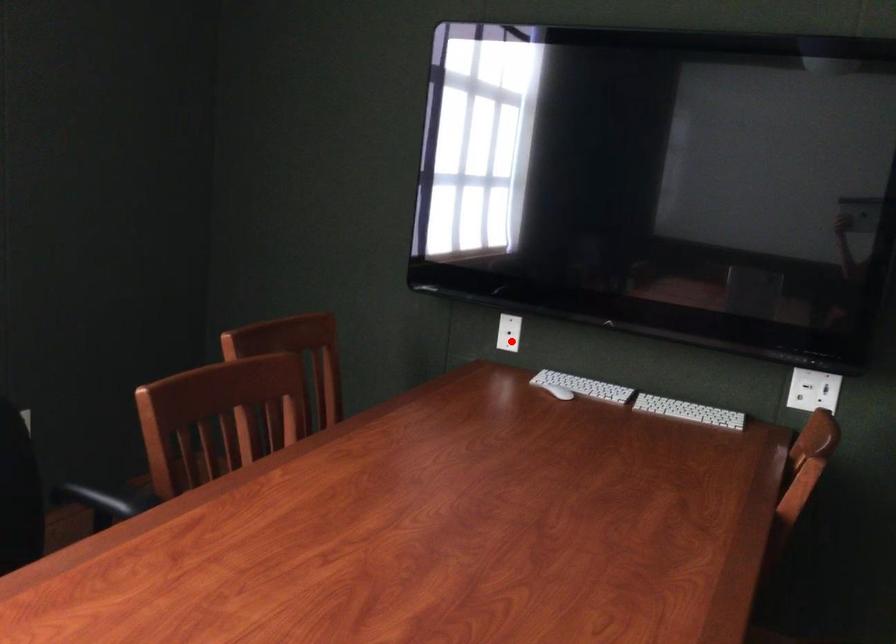
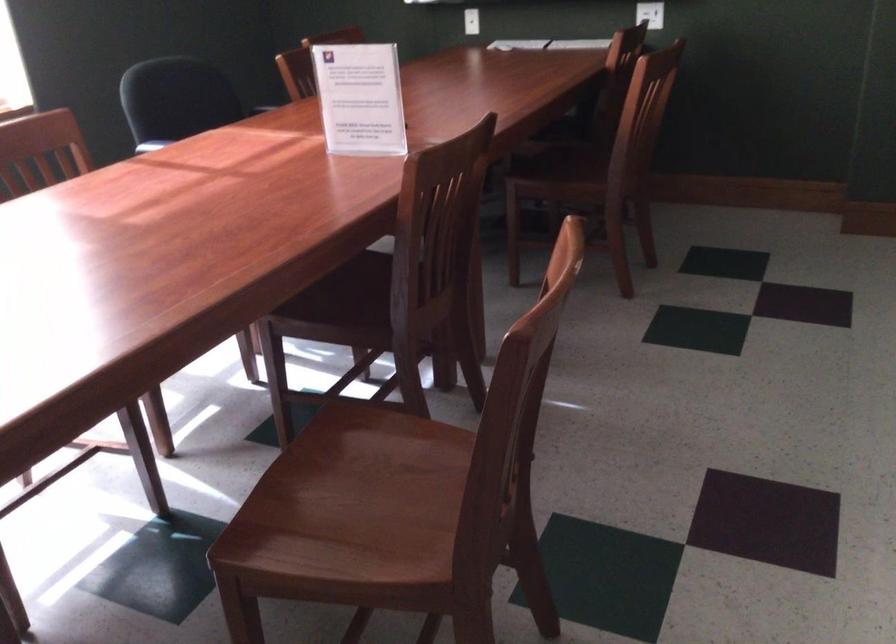
Question: I am providing you with two images of the same scene from different viewpoints. Given a red point in image1, look at the same physical point in image2. Is it:

Choices:
 (A) Closer to the viewpoint
 (B) Farther from the viewpoint

Answer: (B)